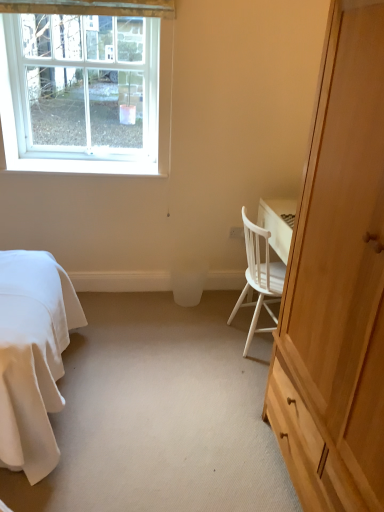
Question: Does point (57, 150) appear closer or farther from the camera than point (367, 112)?

Choices:
 (A) farther
 (B) closer

Answer: (A)

Question: Is white plastic window at upper left inside the boundaries of light wood cabinet at right, or outside?

Choices:
 (A) inside
 (B) outside

Answer: (B)

Question: Which of these objects is positioned farthest from the white plastic power outlet at center?

Choices:
 (A) white wood chair at right
 (B) white plastic window at upper left
 (C) white plastic trash bin/can at center
 (D) light wood cabinet at right

Answer: (D)

Question: Estimate the real-world distances between objects in this image. Which object is farther from the white plastic power outlet at center?

Choices:
 (A) light wood cabinet at right
 (B) white wood chair at right
 (C) white plastic window at upper left
 (D) white plastic trash bin/can at center

Answer: (A)